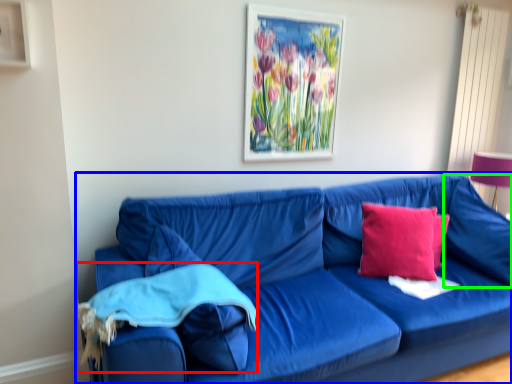
Question: Which is farther away from material (highlighted by a red box)? studio couch (highlighted by a blue box) or pillow (highlighted by a green box)?

Choices:
 (A) studio couch
 (B) pillow

Answer: (B)